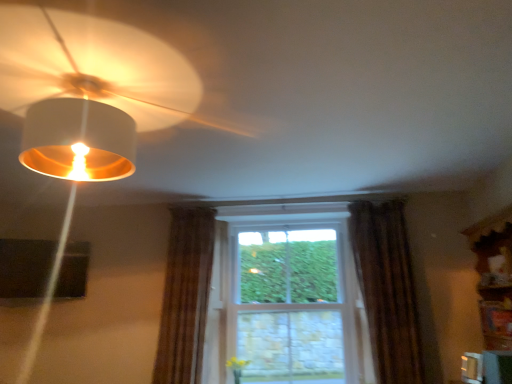
Measure the distance between point (x=125, y=141) and camera.

Point (x=125, y=141) is 1.75 meters from camera.

What is the approximate height of brown textured curtain at right, arranged as the 1th curtain when viewed from the right?

5.16 feet.

Find the location of `matte white lampshade at upper left`. matte white lampshade at upper left is located at coordinates (78, 140).

Which object is further away from the camera, brown textured curtain at right, which appears as the second curtain when viewed from the left, or clear glass window at center?

clear glass window at center is behind.

How many degrees apart are the facing directions of brown textured curtain at right, arranged as the 1th curtain when viewed from the right, and clear glass window at center?

There is a 4.42-degree angle between the facing directions of brown textured curtain at right, arranged as the 1th curtain when viewed from the right, and clear glass window at center.

Which is behind, point (385, 208) or point (250, 296)?

Point (250, 296)

The height and width of the screenshot is (384, 512). I want to click on lamp in front of the clear glass window at center, so click(x=78, y=140).

In the scene shown: Considering the positions of objects clear glass window at center and matte white lampshade at upper left in the image provided, who is more to the left, clear glass window at center or matte white lampshade at upper left?

matte white lampshade at upper left.

How different are the orientations of clear glass window at center and matte white lampshade at upper left in degrees?

79.7 degrees.

Who is more distant, clear glass window at center or matte white lampshade at upper left?

clear glass window at center is behind.

Between brown textured curtain at right, arranged as the 1th curtain when viewed from the right, and matte white lampshade at upper left, which one has smaller size?

With smaller size is matte white lampshade at upper left.

Between point (396, 224) and point (88, 133), which one is positioned behind?

Point (396, 224)

Which curtain is the 2nd one when counting from the right side of the matte white lampshade at upper left? Please provide its 2D coordinates.

[(387, 289)]

Does brown textured curtain at right, which appears as the second curtain when viewed from the left, have a lesser width compared to matte white lampshade at upper left?

Yes.

Is brown textured curtain at center, placed as the first curtain when sorted from left to right, surrounded by clear glass window at center?

No, brown textured curtain at center, placed as the first curtain when sorted from left to right, is not a part of clear glass window at center.

Between clear glass window at center and brown textured curtain at center, placed as the first curtain when sorted from left to right, which one has smaller size?

With smaller size is brown textured curtain at center, placed as the first curtain when sorted from left to right.

Is clear glass window at center next to brown textured curtain at center, the 2th curtain viewed from the right, and touching it?

clear glass window at center is not next to brown textured curtain at center, the 2th curtain viewed from the right, and they're not touching.

Measure the distance between clear glass window at center and brown textured curtain at center, placed as the first curtain when sorted from left to right.

clear glass window at center is 27.47 inches away from brown textured curtain at center, placed as the first curtain when sorted from left to right.

Looking at this image, from the image's perspective, is brown textured curtain at center, placed as the first curtain when sorted from left to right, positioned above or below clear glass window at center?

Clearly, from the image's perspective, brown textured curtain at center, placed as the first curtain when sorted from left to right, is above clear glass window at center.

Considering the sizes of objects brown textured curtain at center, placed as the first curtain when sorted from left to right, and clear glass window at center in the image provided, who is taller, brown textured curtain at center, placed as the first curtain when sorted from left to right, or clear glass window at center?

clear glass window at center.

Is brown textured curtain at center, placed as the first curtain when sorted from left to right, with clear glass window at center?

No, brown textured curtain at center, placed as the first curtain when sorted from left to right, is not making contact with clear glass window at center.

How many degrees apart are the facing directions of brown textured curtain at center, placed as the first curtain when sorted from left to right, and clear glass window at center?

3.55 degrees.

Considering the relative positions of matte white lampshade at upper left and brown textured curtain at center, the 2th curtain viewed from the right, in the image provided, is matte white lampshade at upper left to the left of brown textured curtain at center, the 2th curtain viewed from the right, from the viewer's perspective?

Yes.

Considering the relative sizes of matte white lampshade at upper left and brown textured curtain at center, placed as the first curtain when sorted from left to right, in the image provided, is matte white lampshade at upper left thinner than brown textured curtain at center, placed as the first curtain when sorted from left to right,?

Incorrect, the width of matte white lampshade at upper left is not less than that of brown textured curtain at center, placed as the first curtain when sorted from left to right.

The image size is (512, 384). Find the location of `the 1st curtain to the right of the matte white lampshade at upper left, starting your count from the anchor`. the 1st curtain to the right of the matte white lampshade at upper left, starting your count from the anchor is located at coordinates (185, 296).

Which is nearer, [400,382] or [183,338]?

Point [400,382] is positioned closer to the camera compared to point [183,338].

From a real-world perspective, is brown textured curtain at right, arranged as the 1th curtain when viewed from the right, above or below brown textured curtain at center, the 2th curtain viewed from the right?

brown textured curtain at right, arranged as the 1th curtain when viewed from the right, is situated higher than brown textured curtain at center, the 2th curtain viewed from the right, in the real world.

Looking at this image, which of these two, brown textured curtain at right, arranged as the 1th curtain when viewed from the right, or brown textured curtain at center, placed as the first curtain when sorted from left to right, is wider?

With larger width is brown textured curtain at right, arranged as the 1th curtain when viewed from the right.

Is brown textured curtain at right, arranged as the 1th curtain when viewed from the right, bigger or smaller than brown textured curtain at center, placed as the first curtain when sorted from left to right?

brown textured curtain at right, arranged as the 1th curtain when viewed from the right, is bigger than brown textured curtain at center, placed as the first curtain when sorted from left to right.

Where is `the 2nd curtain directly above the clear glass window at center (from a real-world perspective)`? the 2nd curtain directly above the clear glass window at center (from a real-world perspective) is located at coordinates (387, 289).

Find the location of a particular element. This screenshot has width=512, height=384. bay window beneath the matte white lampshade at upper left (from a real-world perspective) is located at coordinates (290, 307).

Which object lies further to the anchor point matte white lampshade at upper left, brown textured curtain at center, placed as the first curtain when sorted from left to right, or clear glass window at center?

clear glass window at center is positioned further to the anchor matte white lampshade at upper left.

Estimate the real-world distances between objects in this image. Which object is closer to brown textured curtain at right, which appears as the second curtain when viewed from the left, brown textured curtain at center, placed as the first curtain when sorted from left to right, or clear glass window at center?

clear glass window at center lies closer to brown textured curtain at right, which appears as the second curtain when viewed from the left, than the other object.

Looking at the image, which one is located closer to brown textured curtain at center, placed as the first curtain when sorted from left to right, clear glass window at center or matte white lampshade at upper left?

Among the two, clear glass window at center is located nearer to brown textured curtain at center, placed as the first curtain when sorted from left to right.

When comparing their distances from brown textured curtain at center, placed as the first curtain when sorted from left to right, does matte white lampshade at upper left or clear glass window at center seem further?

Among the two, matte white lampshade at upper left is located further to brown textured curtain at center, placed as the first curtain when sorted from left to right.

From the image, which object appears to be nearer to clear glass window at center, brown textured curtain at center, the 2th curtain viewed from the right, or matte white lampshade at upper left?

Among the two, brown textured curtain at center, the 2th curtain viewed from the right, is located nearer to clear glass window at center.

Looking at the image, which one is located further to matte white lampshade at upper left, brown textured curtain at center, placed as the first curtain when sorted from left to right, or brown textured curtain at right, arranged as the 1th curtain when viewed from the right?

The object further to matte white lampshade at upper left is brown textured curtain at right, arranged as the 1th curtain when viewed from the right.

Considering their positions, is brown textured curtain at right, which appears as the second curtain when viewed from the left, positioned further to brown textured curtain at center, placed as the first curtain when sorted from left to right, than matte white lampshade at upper left?

Among the two, brown textured curtain at right, which appears as the second curtain when viewed from the left, is located further to brown textured curtain at center, placed as the first curtain when sorted from left to right.

Looking at this image, considering their positions, is brown textured curtain at right, arranged as the 1th curtain when viewed from the right, positioned closer to matte white lampshade at upper left than clear glass window at center?

clear glass window at center.

What are the coordinates of `bay window between brown textured curtain at center, placed as the first curtain when sorted from left to right, and brown textured curtain at right, which appears as the second curtain when viewed from the left, in the horizontal direction` in the screenshot? It's located at (290, 307).

Locate an element on the screen. Image resolution: width=512 pixels, height=384 pixels. curtain situated between matte white lampshade at upper left and brown textured curtain at right, which appears as the second curtain when viewed from the left, from left to right is located at coordinates click(x=185, y=296).